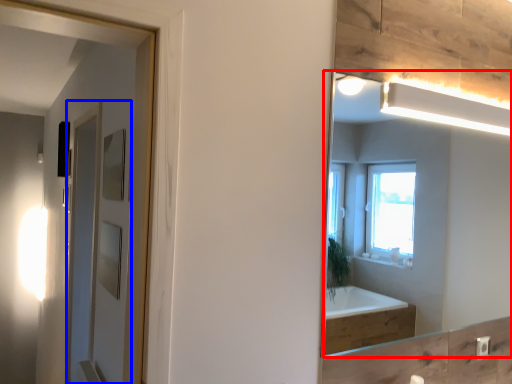
Question: Which of the following is the closest to the observer, mirror (highlighted by a red box) or screen door (highlighted by a blue box)?

Choices:
 (A) mirror
 (B) screen door

Answer: (A)